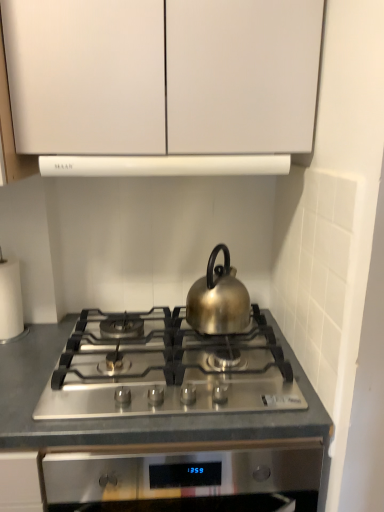
Identify the location of blank space above satin silver gas stove at center (from a real-world perspective). (152, 335).